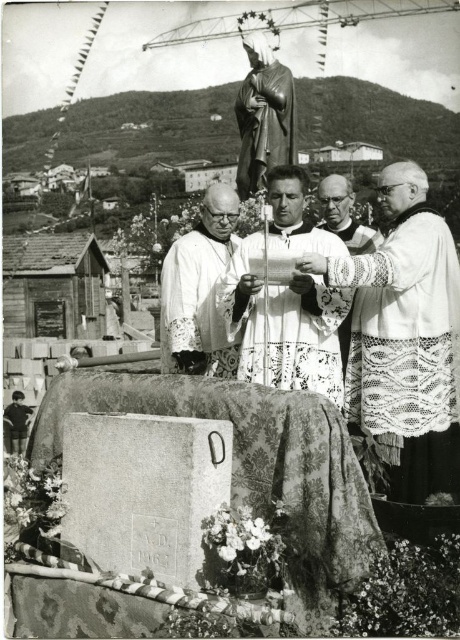
You are a photographer adjusting your camera to focus on two specific points in the scene. The first point is at coordinates point [435,364] and the second is at point [162,369]. Which point should you focus on first to ensure proper depth of field?

Point [435,364] should be focused on first because it is closer to the camera than point [162,369], ensuring proper depth of field.

Based on the scene description, where is the white lace robe at center located in terms of coordinates?

The white lace robe at center is located at point (x=282, y=328).

You are a photographer standing at the front of the ceremony. You need to capture a closeup shot of both the white lace vestment at right and the white lace fabric at center in a single frame. Is it possible with a standard camera lens that has a maximum focal length of 200mm?

The distance between the white lace vestment at right and the white lace fabric at center is 13.14 meters. With a standard camera lens of 200mm, it is possible to capture both in a single frame as the focal length allows for wide enough angle to include objects spaced 13 meters apart at that distance.